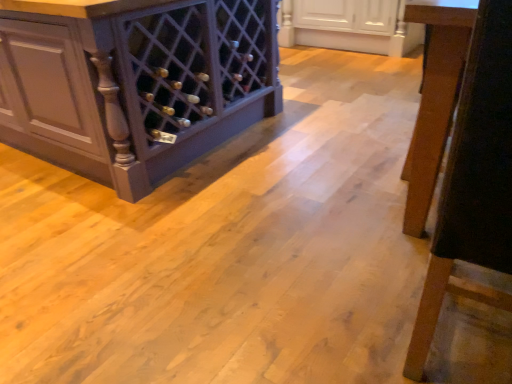
Question: From the image's perspective, is wooden chair leg at right positioned above or below matte dark wood wine rack at left, which ranks as the 2th cabinetry in right-to-left order?

Choices:
 (A) above
 (B) below

Answer: (B)

Question: Considering the positions of wooden chair leg at right and matte dark wood wine rack at left, the 1th cabinetry from the left, in the image, is wooden chair leg at right wider or thinner than matte dark wood wine rack at left, the 1th cabinetry from the left,?

Choices:
 (A) thin
 (B) wide

Answer: (A)

Question: Which object is positioned farthest from the wooden chair leg at right?

Choices:
 (A) white glossy cabinet at upper center, which is counted as the 1th cabinetry, starting from the right
 (B) matte dark wood wine rack at left, which ranks as the 2th cabinetry in right-to-left order

Answer: (A)

Question: Which object is the closest to the wooden chair leg at right?

Choices:
 (A) matte dark wood wine rack at left, which ranks as the 2th cabinetry in right-to-left order
 (B) white glossy cabinet at upper center, which is counted as the 1th cabinetry, starting from the right

Answer: (A)